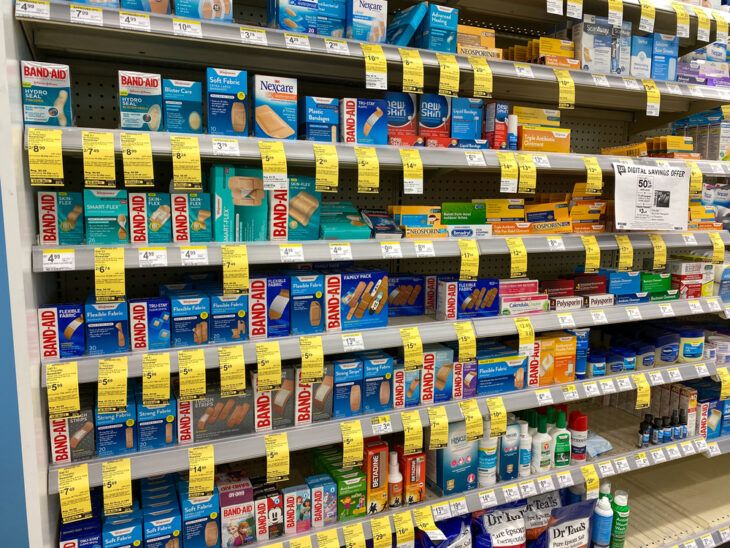
Image resolution: width=730 pixels, height=548 pixels. Find the location of `shelves`. shelves is located at coordinates (453, 509), (379, 423), (390, 342), (387, 244), (374, 156), (350, 52).